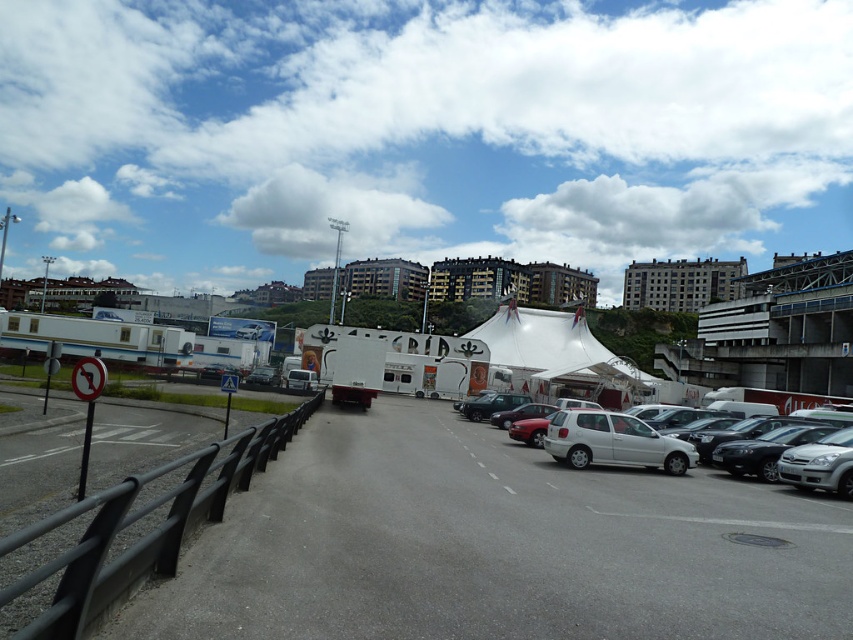
Question: Which is nearer to the white matte parking lot at center?

Choices:
 (A) matte red car at center
 (B) black matte van at center

Answer: (A)

Question: Is white matte parking lot at center above white canvas tent at center?

Choices:
 (A) yes
 (B) no

Answer: (B)

Question: Does white matte hatchback at center have a larger size compared to black matte van at center?

Choices:
 (A) no
 (B) yes

Answer: (A)

Question: Is white matte parking lot at center to the right of white matte trailer at left from the viewer's perspective?

Choices:
 (A) yes
 (B) no

Answer: (A)

Question: Among these points, which one is nearest to the camera?

Choices:
 (A) (167, 522)
 (B) (566, 339)

Answer: (A)

Question: Which object is farther from the camera taking this photo?

Choices:
 (A) black matte van at center
 (B) white matte parking lot at center
 (C) white matte hatchback at center
 (D) matte red car at center

Answer: (A)